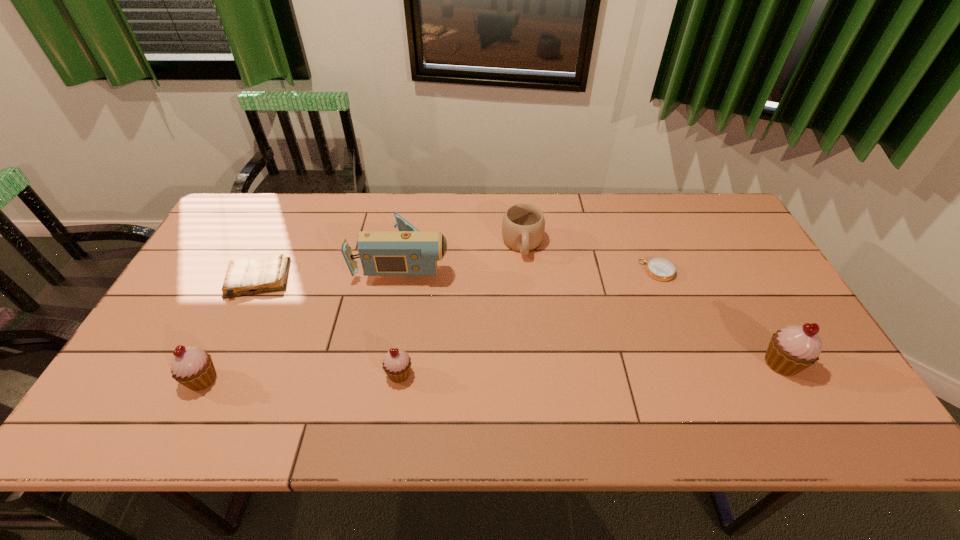
This screenshot has width=960, height=540. In order to click on free space that satisfies the following two spatial constraints: 1. on the back side of the sixth object from left to right; 2. on the side of the camcorder with the flip-out screen in this screenshot , I will do `click(653, 259)`.

Locate an element on the screen. This screenshot has width=960, height=540. vacant region that satisfies the following two spatial constraints: 1. on the side of the shortest cupcake with the flip-out screen; 2. on the right side of the camcorder is located at coordinates (384, 374).

At what (x,y) coordinates should I click in order to perform the action: click on free spot that satisfies the following two spatial constraints: 1. on the side of the tallest cupcake with the handle; 2. on the right side of the mug. Please return your answer as a coordinate pair (x, y). This screenshot has width=960, height=540. Looking at the image, I should click on (535, 363).

The height and width of the screenshot is (540, 960). I want to click on free space that satisfies the following two spatial constraints: 1. on the side of the camcorder with the flip-out screen; 2. on the left side of the second cupcake from right to left, so click(384, 374).

Where is `vacant region that satisfies the following two spatial constraints: 1. on the back side of the fifth shortest object; 2. on the right side of the shortest object`? vacant region that satisfies the following two spatial constraints: 1. on the back side of the fifth shortest object; 2. on the right side of the shortest object is located at coordinates (256, 271).

Locate an element on the screen. The height and width of the screenshot is (540, 960). free spot that satisfies the following two spatial constraints: 1. on the back side of the shortest cupcake; 2. on the right side of the third tallest object is located at coordinates click(205, 374).

Locate an element on the screen. vacant area that satisfies the following two spatial constraints: 1. on the side of the camcorder with the flip-out screen; 2. on the back side of the rightmost cupcake is located at coordinates (386, 363).

Locate an element on the screen. free space that satisfies the following two spatial constraints: 1. on the back side of the fifth shortest object; 2. on the left side of the shortest cupcake is located at coordinates (205, 374).

Find the location of `vacant point that satisfies the following two spatial constraints: 1. on the back side of the shortest cupcake; 2. on the left side of the second object from right to left`. vacant point that satisfies the following two spatial constraints: 1. on the back side of the shortest cupcake; 2. on the left side of the second object from right to left is located at coordinates (415, 271).